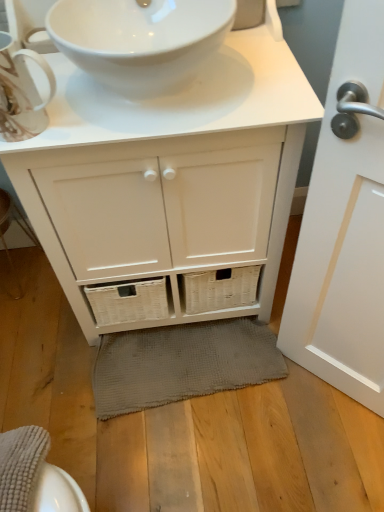
Question: Should I look upward or downward to see gray textured bath mat at lower center?

Choices:
 (A) down
 (B) up

Answer: (A)

Question: Is white matte cabinet at center placed right next to matte white teacup at upper left?

Choices:
 (A) no
 (B) yes

Answer: (A)

Question: From a real-world perspective, is white matte cabinet at center under matte white teacup at upper left?

Choices:
 (A) yes
 (B) no

Answer: (A)

Question: From the image's perspective, is white matte cabinet at center above matte white teacup at upper left?

Choices:
 (A) yes
 (B) no

Answer: (B)

Question: Is white matte cabinet at center aimed at matte white teacup at upper left?

Choices:
 (A) no
 (B) yes

Answer: (A)

Question: Is white matte cabinet at center behind matte white teacup at upper left?

Choices:
 (A) no
 (B) yes

Answer: (B)

Question: Can you confirm if white matte cabinet at center is wider than matte white teacup at upper left?

Choices:
 (A) yes
 (B) no

Answer: (A)

Question: Is white glossy sink at upper center aimed at gray textured bath mat at lower center?

Choices:
 (A) no
 (B) yes

Answer: (A)

Question: From the image's perspective, does white glossy sink at upper center appear higher than gray textured bath mat at lower center?

Choices:
 (A) yes
 (B) no

Answer: (A)

Question: Is white glossy sink at upper center turned away from gray textured bath mat at lower center?

Choices:
 (A) yes
 (B) no

Answer: (B)

Question: Considering the relative sizes of white glossy sink at upper center and gray textured bath mat at lower center in the image provided, is white glossy sink at upper center bigger than gray textured bath mat at lower center?

Choices:
 (A) no
 (B) yes

Answer: (B)

Question: Is white glossy sink at upper center next to gray textured bath mat at lower center?

Choices:
 (A) no
 (B) yes

Answer: (A)

Question: Is white glossy sink at upper center outside gray textured bath mat at lower center?

Choices:
 (A) no
 (B) yes

Answer: (B)

Question: From the image's perspective, is gray textured bath mat at lower center over white glossy door handle at right?

Choices:
 (A) yes
 (B) no

Answer: (B)